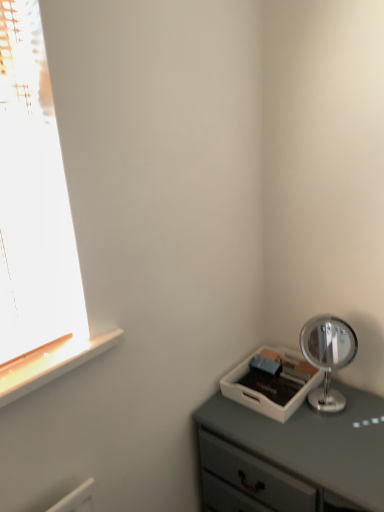
Where is `free space below polished silver mirror at right (from a real-world perspective)`? The height and width of the screenshot is (512, 384). free space below polished silver mirror at right (from a real-world perspective) is located at coordinates (324, 405).